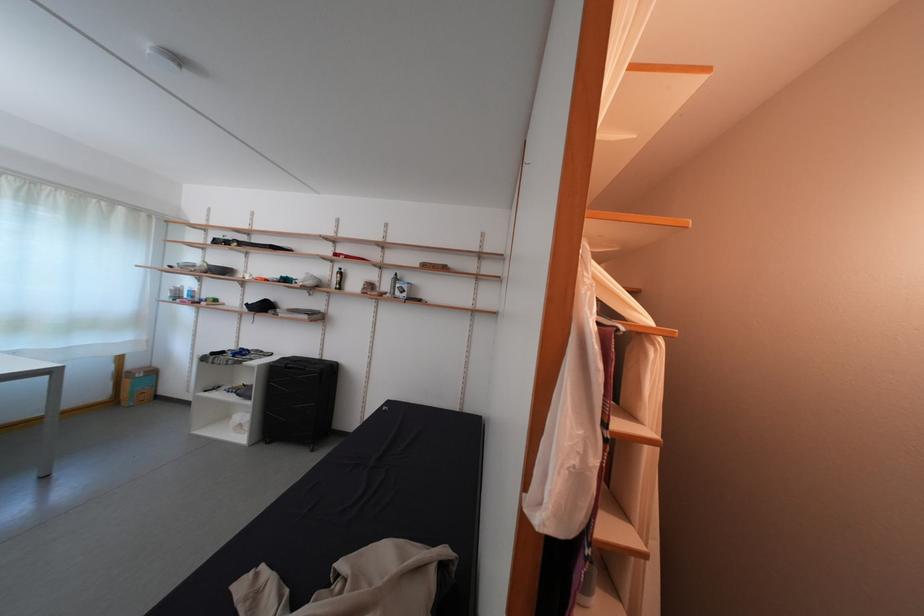
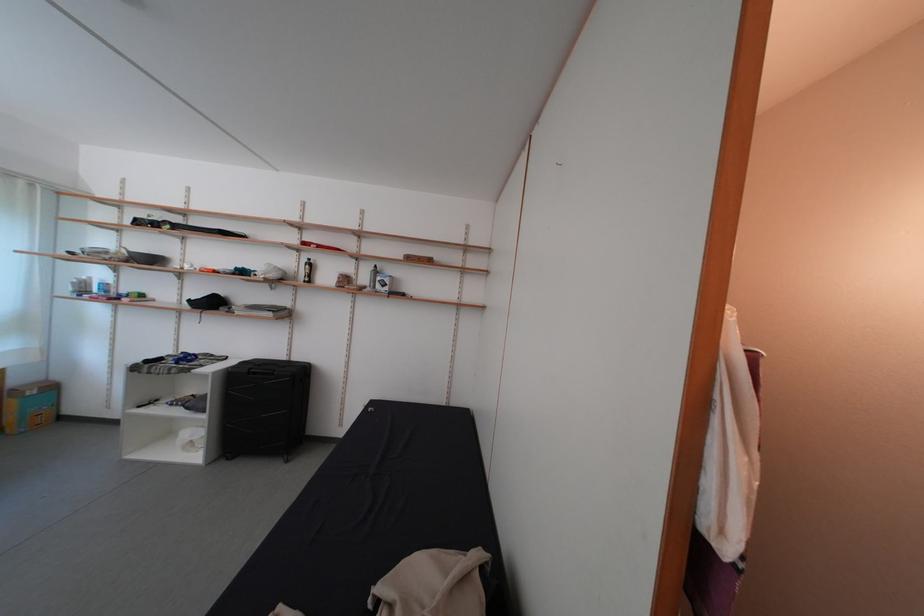
Question: How did the camera likely rotate?

Choices:
 (A) Left
 (B) Right
 (C) Up
 (D) Down

Answer: (B)